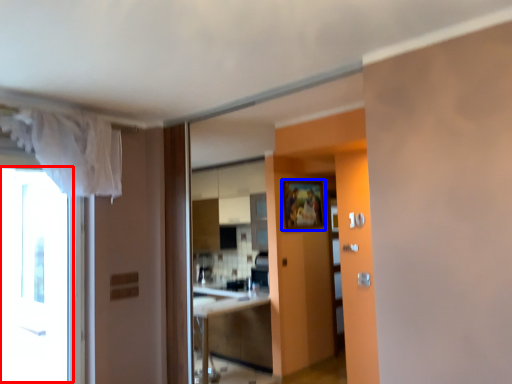
Question: Which point is closer to the camera, window (highlighted by a red box) or picture frame (highlighted by a blue box)?

Choices:
 (A) window
 (B) picture frame

Answer: (A)